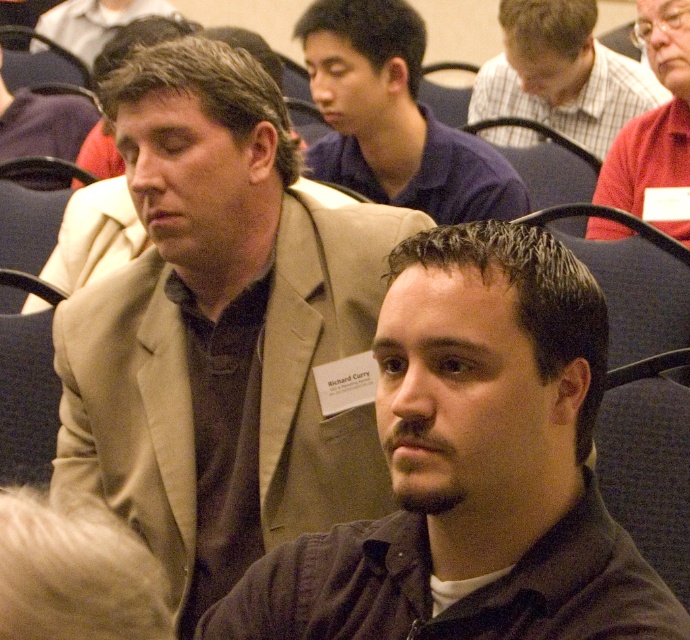
You are standing in the conference room and want to determine which of the two points, point (546, 611) or point (647, 33), is closer to you. Based on the scene description, which point is nearer?

Point (546, 611) is closer to the camera than point (647, 33), so it is nearer to you.